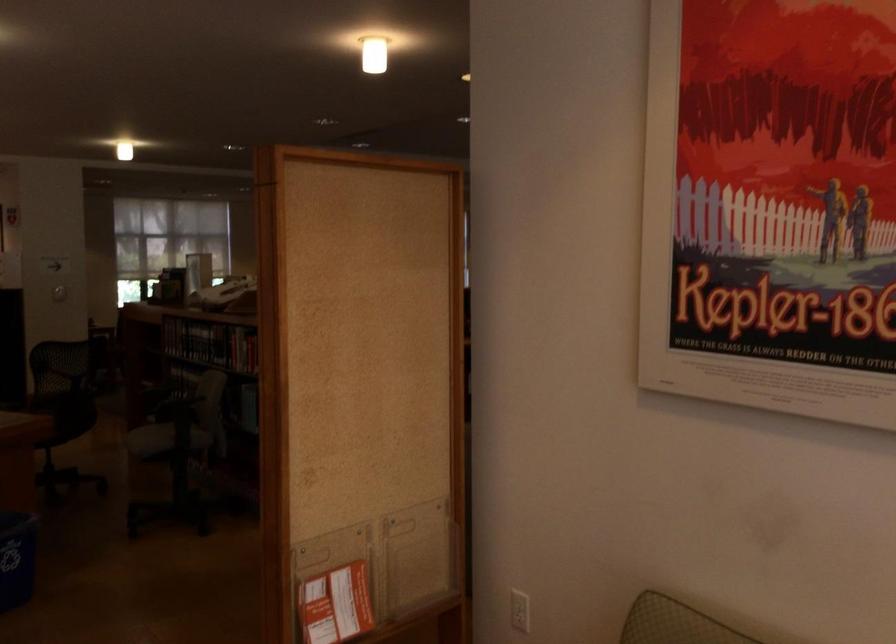
Where would you lift the telephone handset? Please return your answer as a coordinate pair (x, y).

(222, 292)